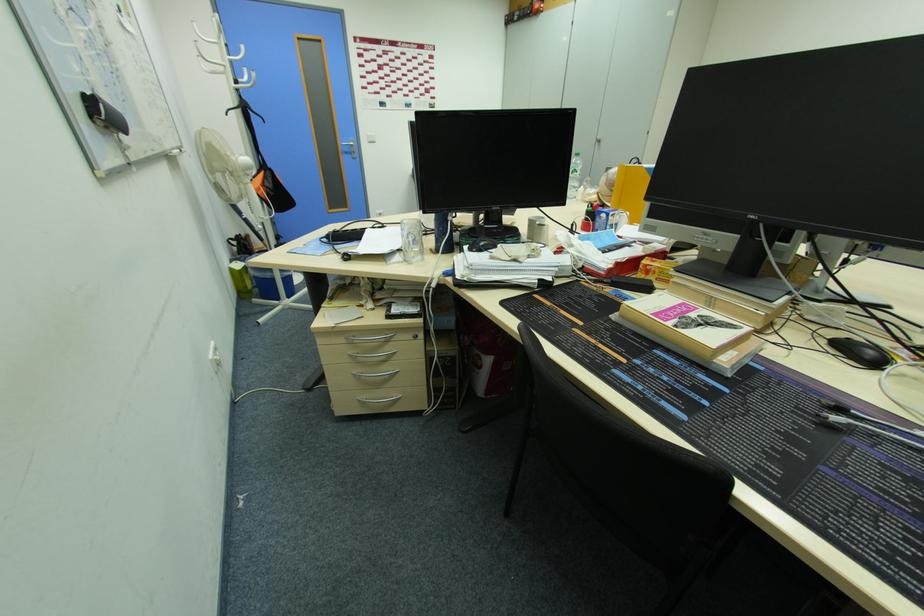
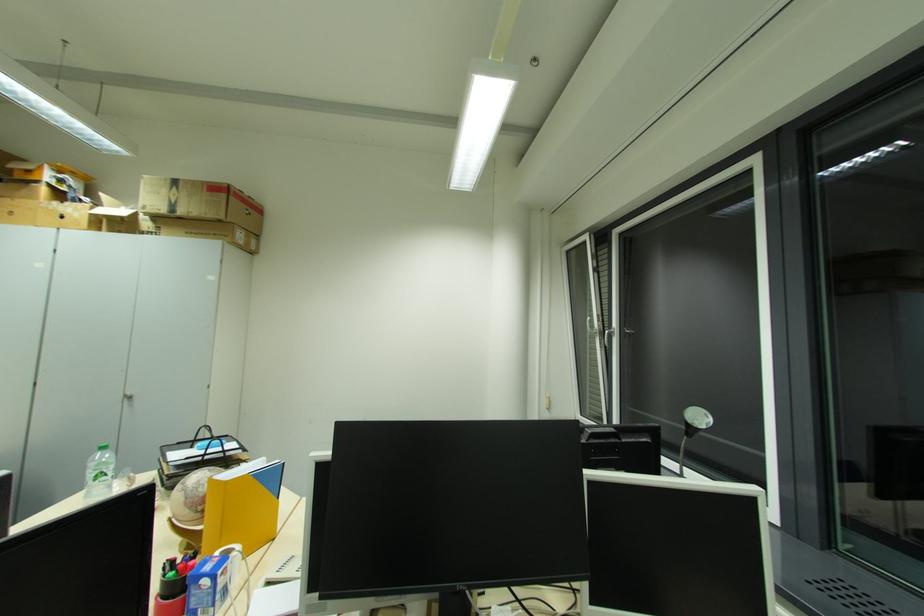
In the second image, find the point that corresponds to (x=596, y=206) in the first image.

(176, 564)